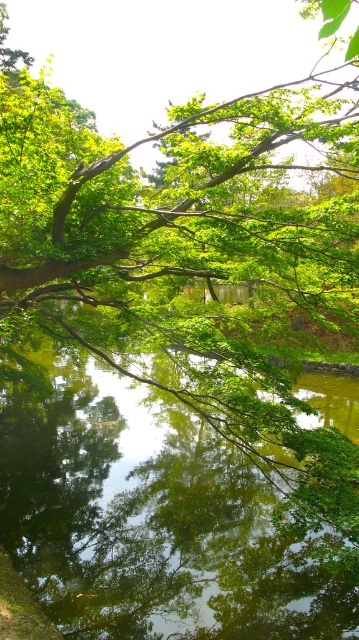
Does point (347, 211) lie in front of point (6, 433)?

Yes.

From the picture: Is green leafy branch at upper center in front of green reflective water at center?

Yes, it is in front of green reflective water at center.

Describe the element at coordinates (185, 202) in the screenshot. The width and height of the screenshot is (359, 640). I see `green leafy branch at upper center` at that location.

The image size is (359, 640). What are the coordinates of `green leafy branch at upper center` in the screenshot? It's located at (185, 202).